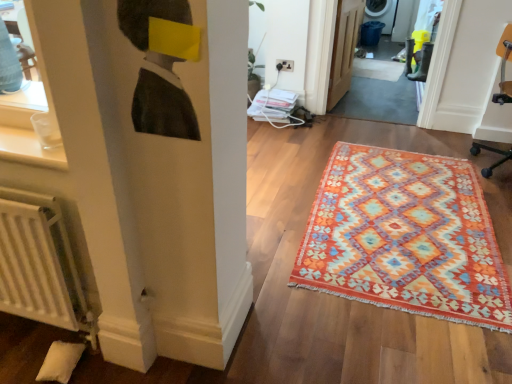
At what (x,y) coordinates should I click in order to perform the action: click on free space to the back side of orange fabric swivel chair at right. Please return your answer as a coordinate pair (x, y). Looking at the image, I should click on (461, 141).